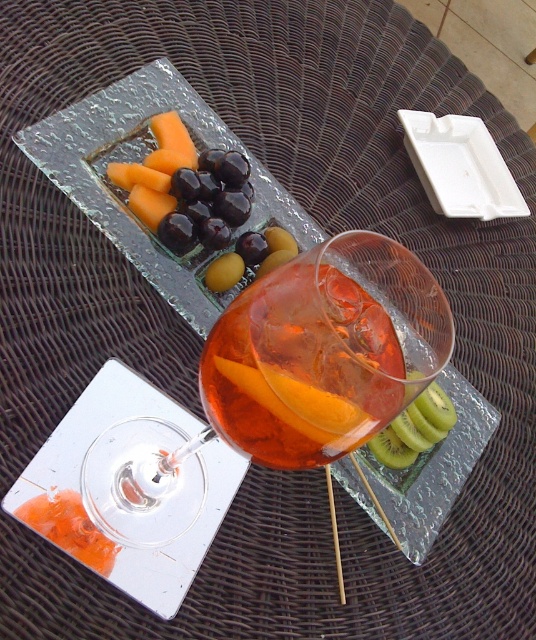
You are setting up a table for a party and want to place the translucent glass wine glass at center and the green matte kiwi at lower right. Since you need to ensure proper spacing between them, which object requires more space due to its size?

The translucent glass wine glass at center requires more space because it is larger in size than the green matte kiwi at lower right.

You are setting up a fruit platter and need to place the green kiwi at lower right and the yellow matte kiwi at center. Which kiwi has a larger width?

The green kiwi at lower right has a larger width than the yellow matte kiwi at center.

You are holding a small toy drone that can fly up to 20 centimeters away from your current position. You want to take a photo of the translucent glass wine glass at center from above. Can your drone reach the glass without exceeding its maximum flight distance?

The distance between the translucent glass wine glass at center and the viewer is 19.80 centimeters, so yes, the drone can reach it since 19.80 cm is within the 20 cm limit.